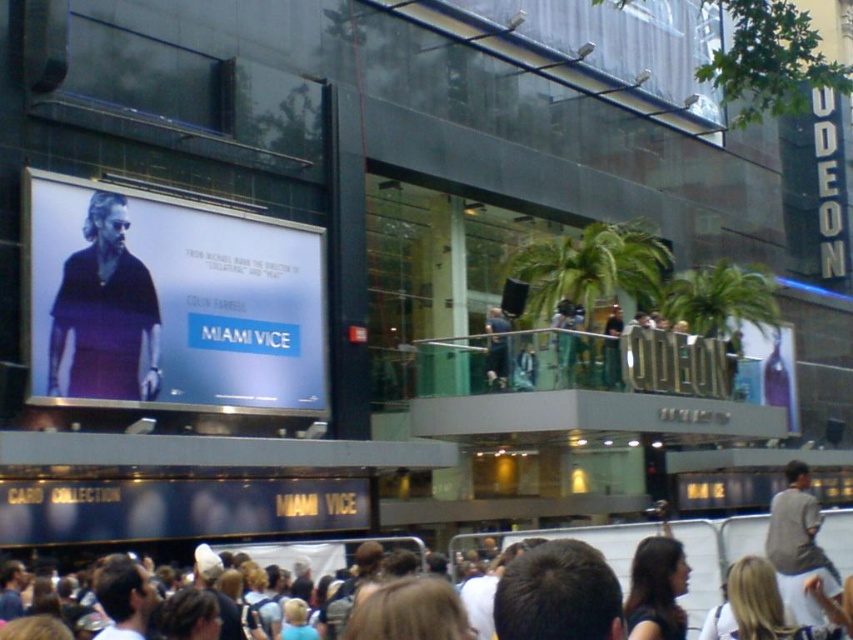
Question: Is blue matte signboard at center positioned behind brown hair at center?

Choices:
 (A) no
 (B) yes

Answer: (B)

Question: Which of the following is the closest to the observer?

Choices:
 (A) (0, 628)
 (B) (828, 589)
 (C) (56, 304)
 (D) (532, 561)

Answer: (D)

Question: Based on their relative distances, which object is nearer to the matte black jacket at upper center?

Choices:
 (A) matte purple poster at upper left
 (B) gray fabric jacket at lower right
 (C) dark brown hair at center
 (D) brown hair at center

Answer: (B)

Question: Is white cotton shirt at center positioned behind blue denim jeans at center?

Choices:
 (A) yes
 (B) no

Answer: (B)

Question: Which object is closer to the camera taking this photo?

Choices:
 (A) purple matte shirt at upper left
 (B) matte black jacket at upper center

Answer: (A)

Question: Is matte purple poster at upper left bigger than white cotton shirt at center?

Choices:
 (A) no
 (B) yes

Answer: (A)